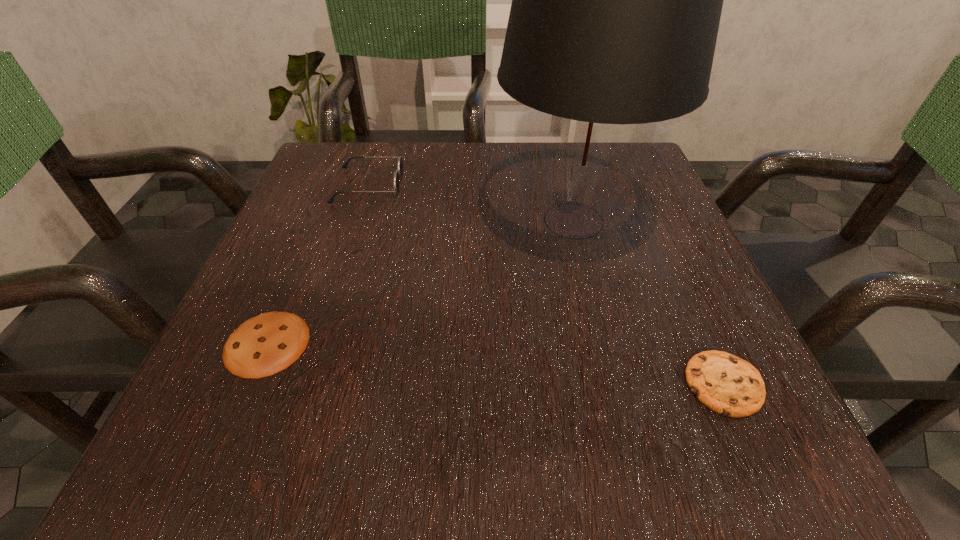
In order to click on lampshade in this screenshot , I will do `click(616, 0)`.

Identify the location of the third shortest object. pyautogui.click(x=398, y=174).

Find the location of a particular element. This screenshot has height=540, width=960. the right cookie is located at coordinates (726, 384).

I want to click on the left cookie, so click(x=266, y=344).

Locate an element on the screen. vacant space located 0.300m on the front of the tallest object is located at coordinates (631, 456).

Image resolution: width=960 pixels, height=540 pixels. What are the coordinates of `vacant space located 0.070m on the front-facing side of the second tallest object` in the screenshot? It's located at (435, 185).

I want to click on blank space located on the left of the right cookie, so click(410, 384).

Locate an element on the screen. The height and width of the screenshot is (540, 960). free spot located on the front of the left cookie is located at coordinates (238, 413).

This screenshot has height=540, width=960. What are the coordinates of `lampshade located at the far edge` in the screenshot? It's located at click(x=616, y=0).

You are a GUI agent. You are given a task and a screenshot of the screen. Output one action in this format:
    pyautogui.click(x=<x>, y=<y>)
    Task: Click on the sunglasses that is at the far edge
    The image size is (960, 540).
    Given the screenshot: What is the action you would take?
    pyautogui.click(x=398, y=174)